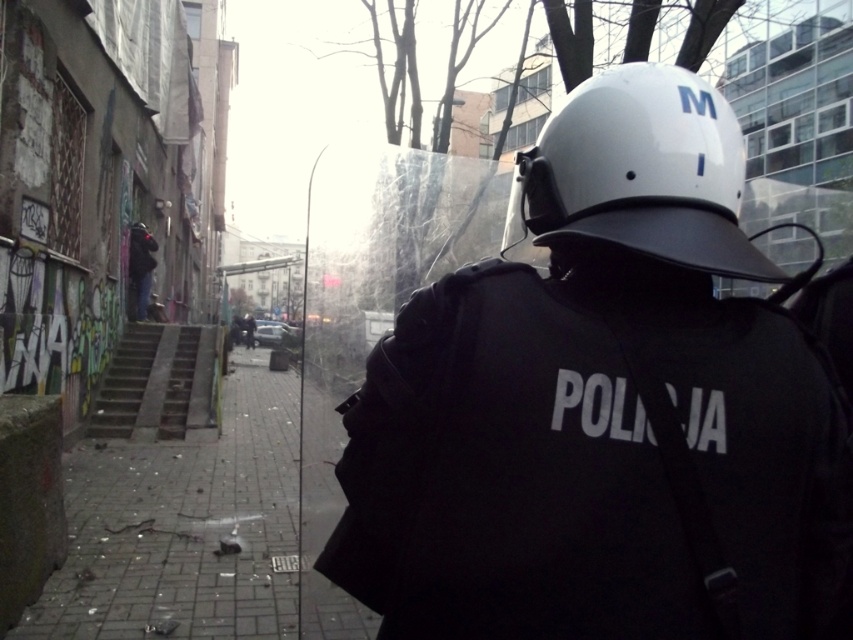
You are standing in the scene and want to move from point (x=640, y=99) to point (x=173, y=356). Given that you can only move forward and cannot turn around, will you get closer to or farther from the police officer as you move?

As you move from point (x=640, y=99) to point (x=173, y=356), you will get farther from the police officer because point (x=640, y=99) is closer to the viewer than point (x=173, y=356).

You are standing in the middle of the street in the image. You want to locate the white matte helmet at upper center. Which direction should you look to find it?

The white matte helmet at upper center is located at point (x=604, y=406), so you should look towards the upper center direction to find it.